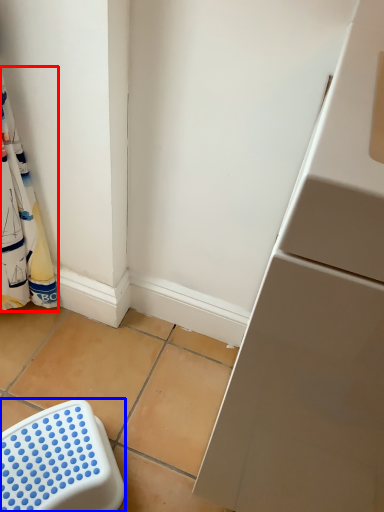
Question: Which point is closer to the camera, laundry (highlighted by a red box) or furniture (highlighted by a blue box)?

Choices:
 (A) laundry
 (B) furniture

Answer: (A)